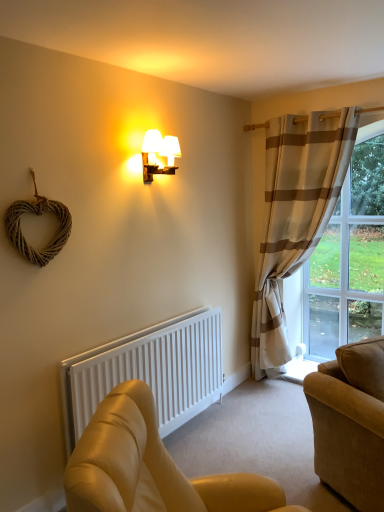
At what (x,y) coordinates should I click in order to perform the action: click on vacant space to the left of beige striped curtain at right. Please return your answer as a coordinate pair (x, y). Image resolution: width=384 pixels, height=512 pixels. Looking at the image, I should click on (249, 403).